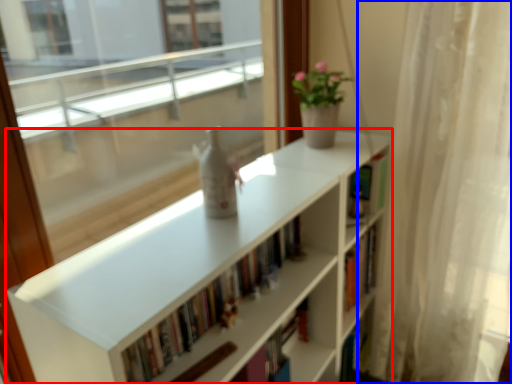
Question: Which object is closer to the camera taking this photo, bookcase (highlighted by a red box) or curtain (highlighted by a blue box)?

Choices:
 (A) bookcase
 (B) curtain

Answer: (A)